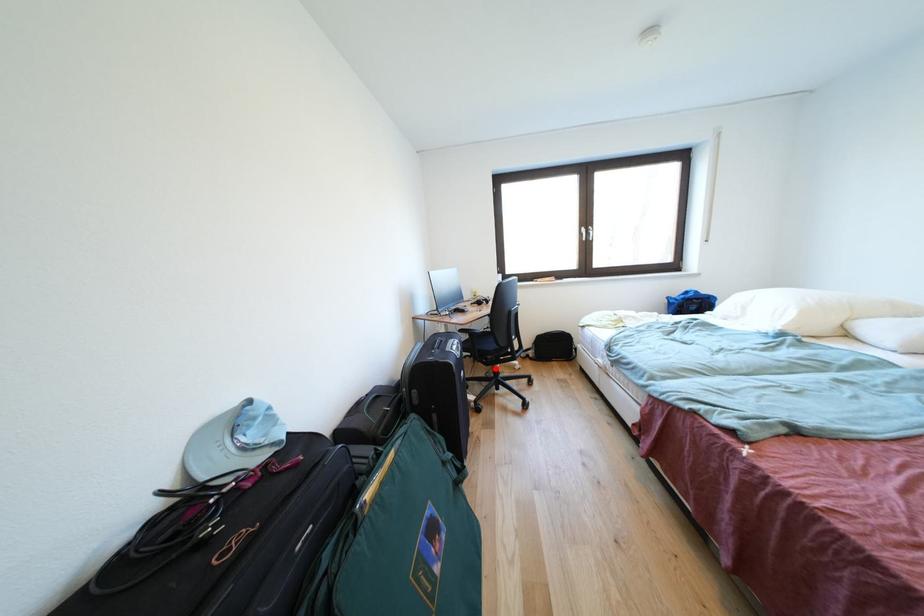
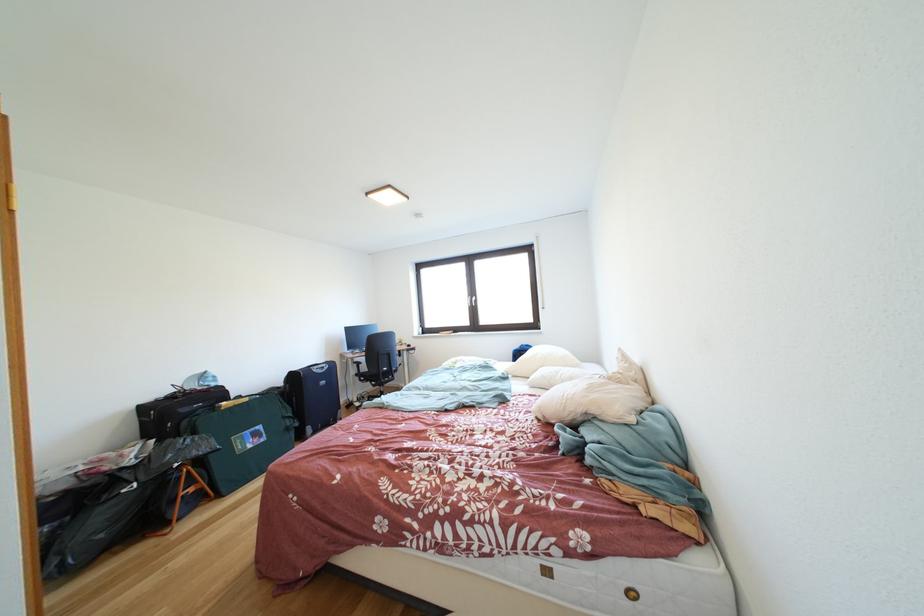
Find the pixel in the second image that matches the highlighted location in the first image.

(383, 391)